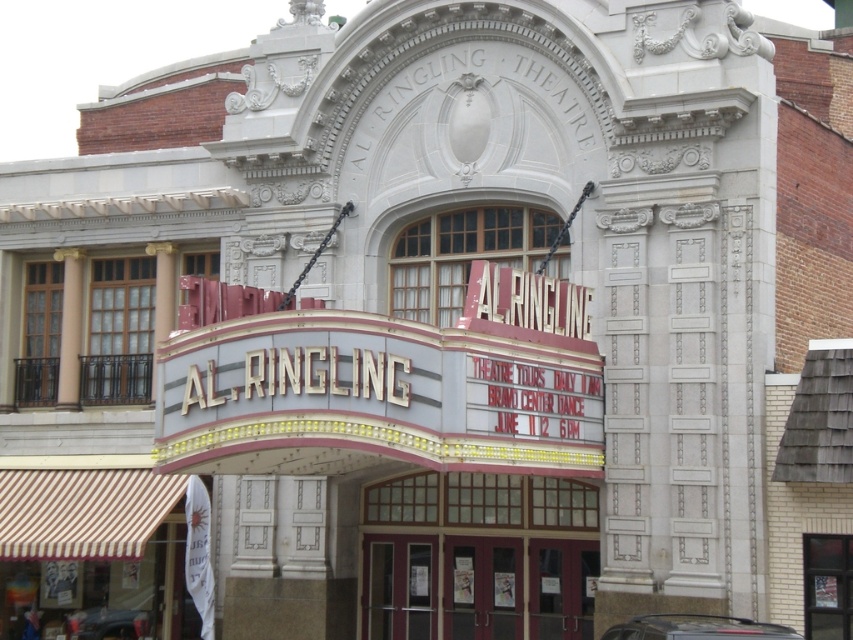
Is shiny black car at lower center above shiny black car at lower left?

Correct, shiny black car at lower center is located above shiny black car at lower left.

Where is `shiny black car at lower center`? shiny black car at lower center is located at coordinates (695, 627).

Does glass door at center have a greater width compared to shiny black car at lower center?

In fact, glass door at center might be narrower than shiny black car at lower center.

From the picture: Measure the distance between glass door at center and shiny black car at lower center.

The distance of glass door at center from shiny black car at lower center is 10.56 feet.

Which is behind, point (834, 554) or point (692, 621)?

Positioned behind is point (834, 554).

Where is `glass door at center`? glass door at center is located at coordinates (827, 586).

Is glass door at center behind shiny black car at lower left?

No, glass door at center is in front of shiny black car at lower left.

Does glass door at center appear on the left side of shiny black car at lower left?

No, glass door at center is not to the left of shiny black car at lower left.

What do you see at coordinates (827, 586) in the screenshot? I see `glass door at center` at bounding box center [827, 586].

This screenshot has width=853, height=640. What are the coordinates of `glass door at center` in the screenshot? It's located at (827, 586).